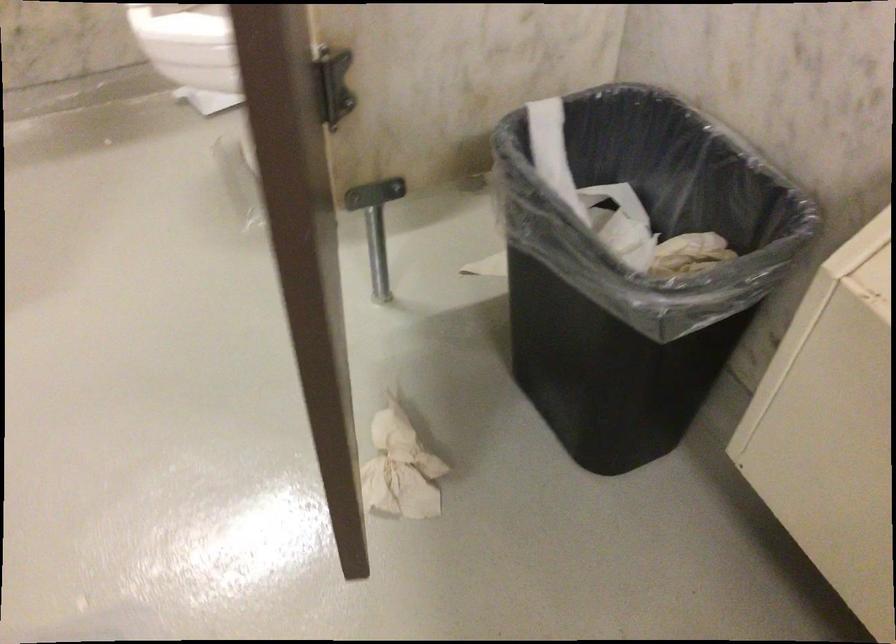
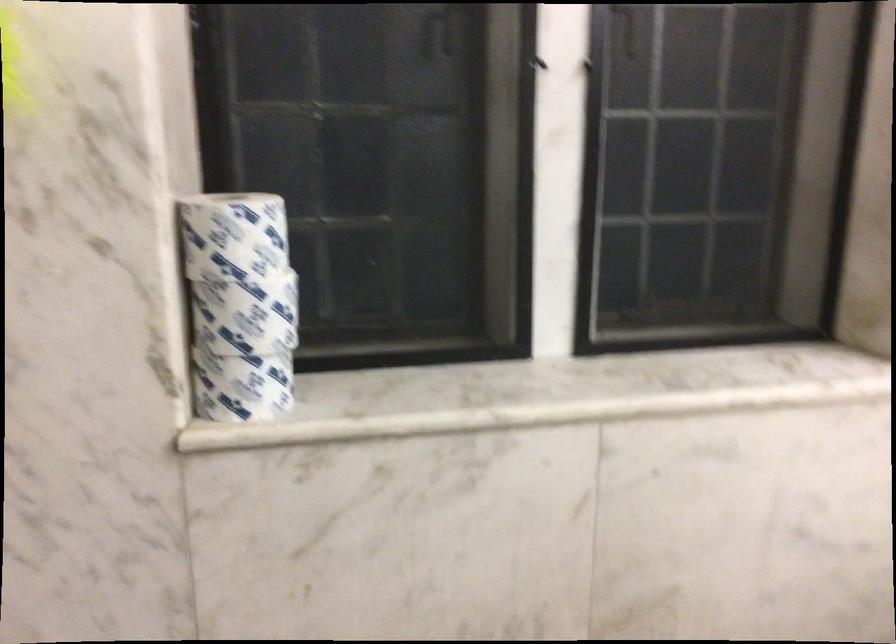
Question: The images are taken continuously from a first-person perspective. In which direction is your viewpoint rotating?

Choices:
 (A) Left
 (B) Right
 (C) Up
 (D) Down

Answer: (B)